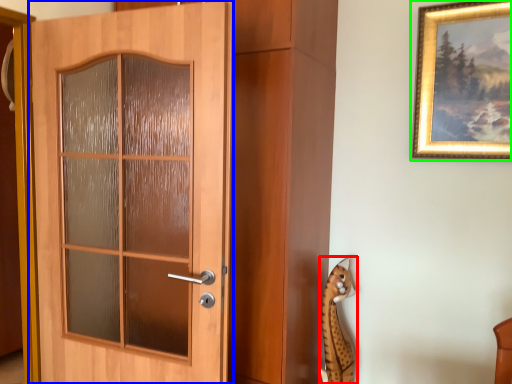
Question: Which is nearer to the animal (highlighted by a red box)? door (highlighted by a blue box) or picture frame (highlighted by a green box).

Choices:
 (A) door
 (B) picture frame

Answer: (B)